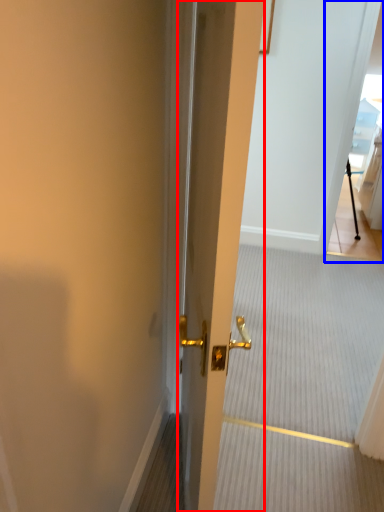
Question: Which object is closer to the camera taking this photo, door (highlighted by a red box) or glass door (highlighted by a blue box)?

Choices:
 (A) door
 (B) glass door

Answer: (A)